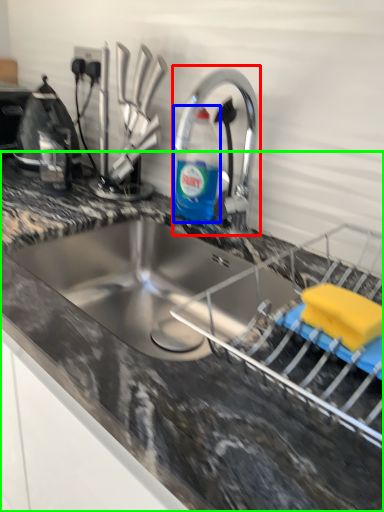
Question: Which is farther away from tap (highlighted by a red box)? bottle (highlighted by a blue box) or countertop (highlighted by a green box)?

Choices:
 (A) bottle
 (B) countertop

Answer: (B)